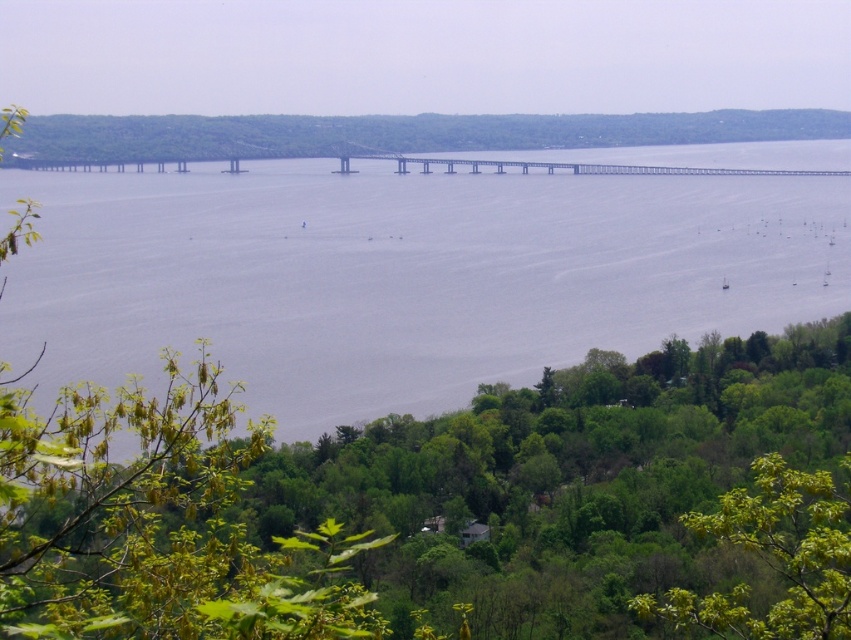
Question: In this image, where is green leafy tree at lower center located relative to green leafy tree at lower right?

Choices:
 (A) right
 (B) left

Answer: (B)

Question: Is green leafy tree at lower center wider than green leafy tree at lower right?

Choices:
 (A) yes
 (B) no

Answer: (A)

Question: Which object is the farthest from the green leafy tree at lower center?

Choices:
 (A) gray water at center
 (B) green leafy tree at lower right
 (C) metallic gray bridge at center

Answer: (C)

Question: Based on their relative distances, which object is farther from the metallic gray bridge at center?

Choices:
 (A) green leafy tree at lower center
 (B) green leafy tree at lower right

Answer: (B)

Question: Considering the real-world distances, which object is closest to the metallic gray bridge at center?

Choices:
 (A) gray water at center
 (B) green leafy tree at lower center
 (C) green leafy tree at lower right

Answer: (A)

Question: Does gray water at center come behind green leafy tree at lower right?

Choices:
 (A) no
 (B) yes

Answer: (A)